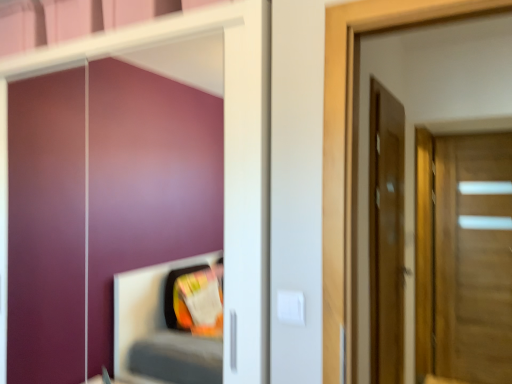
Question: Would you say wooden door at right, the 2th door from the front, contains matte wooden door at right, placed as the 1th door when sorted from left to right?

Choices:
 (A) yes
 (B) no

Answer: (B)

Question: Does wooden door at right, the 2th door from the front, have a lesser width compared to matte wooden door at right, the 2th door in the right-to-left sequence?

Choices:
 (A) no
 (B) yes

Answer: (A)

Question: Is wooden door at right, which is counted as the 2th door, starting from the left, in front of matte wooden door at right, positioned as the first door in front-to-back order?

Choices:
 (A) no
 (B) yes

Answer: (A)

Question: Is wooden door at right, which is counted as the 2th door, starting from the left, looking in the opposite direction of matte wooden door at right, the 2th door in the right-to-left sequence?

Choices:
 (A) no
 (B) yes

Answer: (A)

Question: Is wooden door at right, the 2th door from the front, bigger than matte wooden door at right, placed as the 1th door when sorted from left to right?

Choices:
 (A) yes
 (B) no

Answer: (A)

Question: Considering the relative positions of wooden door at right, which is counted as the 2th door, starting from the left, and matte wooden door at right, the 2th door in the right-to-left sequence, in the image provided, is wooden door at right, which is counted as the 2th door, starting from the left, behind matte wooden door at right, the 2th door in the right-to-left sequence,?

Choices:
 (A) no
 (B) yes

Answer: (B)

Question: Does matte wooden door at right, acting as the 2th door starting from the back, have a smaller size compared to wooden door at right, the first door from the right?

Choices:
 (A) no
 (B) yes

Answer: (B)

Question: Can you confirm if matte wooden door at right, acting as the 2th door starting from the back, is thinner than wooden door at right, which is the 1th door from back to front?

Choices:
 (A) yes
 (B) no

Answer: (A)

Question: Is matte wooden door at right, placed as the 1th door when sorted from left to right, closer to the viewer compared to wooden door at right, which is counted as the 2th door, starting from the left?

Choices:
 (A) no
 (B) yes

Answer: (B)

Question: Can you confirm if matte wooden door at right, positioned as the first door in front-to-back order, is positioned to the left of wooden door at right, which is the 1th door from back to front?

Choices:
 (A) no
 (B) yes

Answer: (B)

Question: Considering the relative sizes of matte wooden door at right, positioned as the first door in front-to-back order, and wooden door at right, which is the 1th door from back to front, in the image provided, is matte wooden door at right, positioned as the first door in front-to-back order, taller than wooden door at right, which is the 1th door from back to front,?

Choices:
 (A) yes
 (B) no

Answer: (B)

Question: Is matte wooden door at right, the 2th door in the right-to-left sequence, turned away from wooden door at right, the first door from the right?

Choices:
 (A) yes
 (B) no

Answer: (B)

Question: From the image's perspective, is matte wooden door at right, positioned as the first door in front-to-back order, located above or below wooden door at right, which is the 1th door from back to front?

Choices:
 (A) below
 (B) above

Answer: (B)